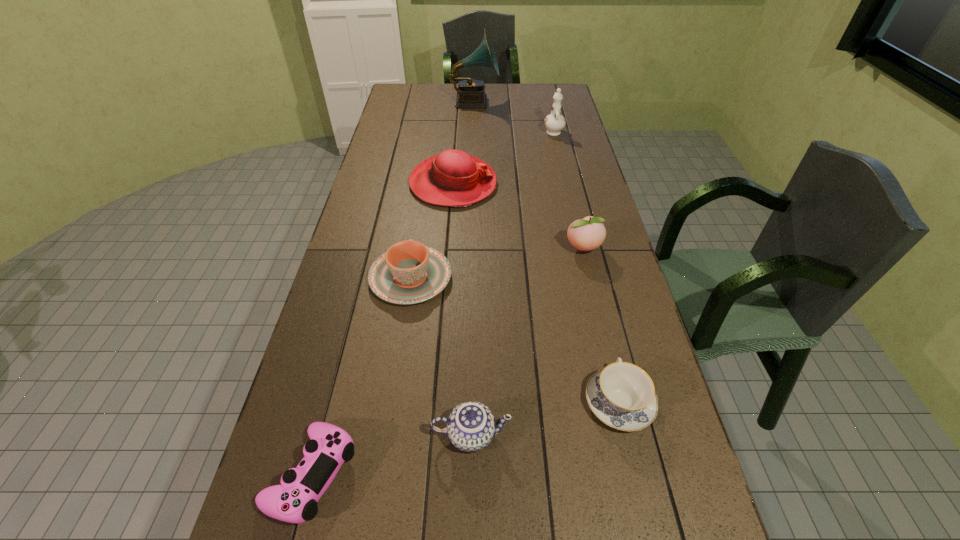
The height and width of the screenshot is (540, 960). I want to click on vacant space located 0.120m at the spout of the seventh shortest object, so click(549, 112).

Where is `vacant region located at the spout of the seventh shortest object`? This screenshot has width=960, height=540. vacant region located at the spout of the seventh shortest object is located at coordinates (548, 107).

I want to click on vacant space situated at the spout of the seventh shortest object, so click(544, 94).

Locate an element on the screen. The width and height of the screenshot is (960, 540). vacant space situated at the front of the sixth nearest object with a bow is located at coordinates pos(595,184).

Locate an element on the screen. free spot located 0.360m on the back of the peach is located at coordinates (565, 174).

The image size is (960, 540). Identify the location of vacant region located 0.110m on the handle side of the third nearest chinaware. (419, 227).

Image resolution: width=960 pixels, height=540 pixels. I want to click on free space located on the handle side of the third nearest chinaware, so click(x=419, y=227).

Identify the location of vacant region located 0.240m on the handle side of the third nearest chinaware. The height and width of the screenshot is (540, 960). (421, 204).

Locate an element on the screen. vacant space located on the right of the control is located at coordinates (389, 475).

This screenshot has height=540, width=960. Find the location of `vacant space located 0.080m with the handle on the side of the shortest chinaware`. vacant space located 0.080m with the handle on the side of the shortest chinaware is located at coordinates (605, 343).